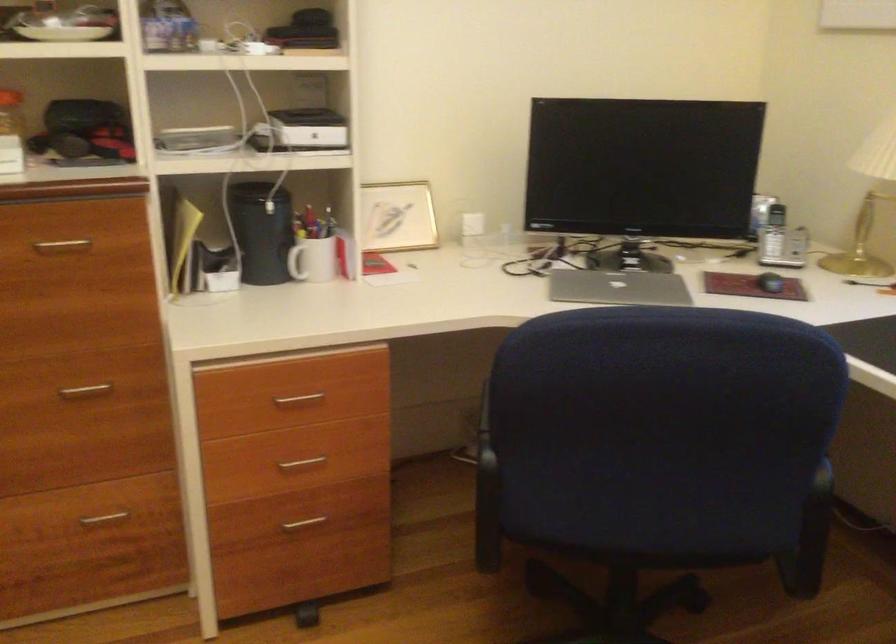
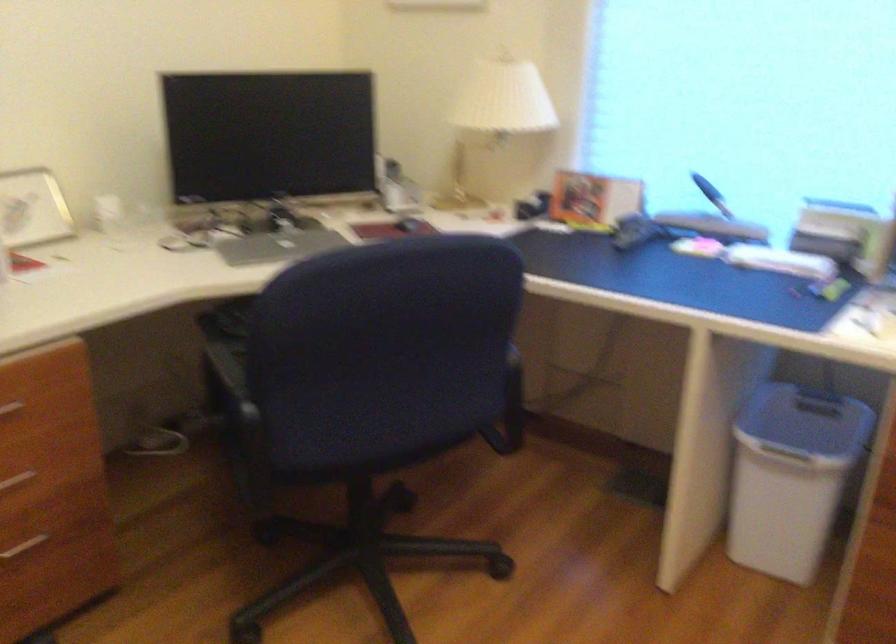
Question: The first image is from the beginning of the video and the second image is from the end. How did the camera likely rotate when shooting the video?

Choices:
 (A) Left
 (B) Right
 (C) Up
 (D) Down

Answer: (B)